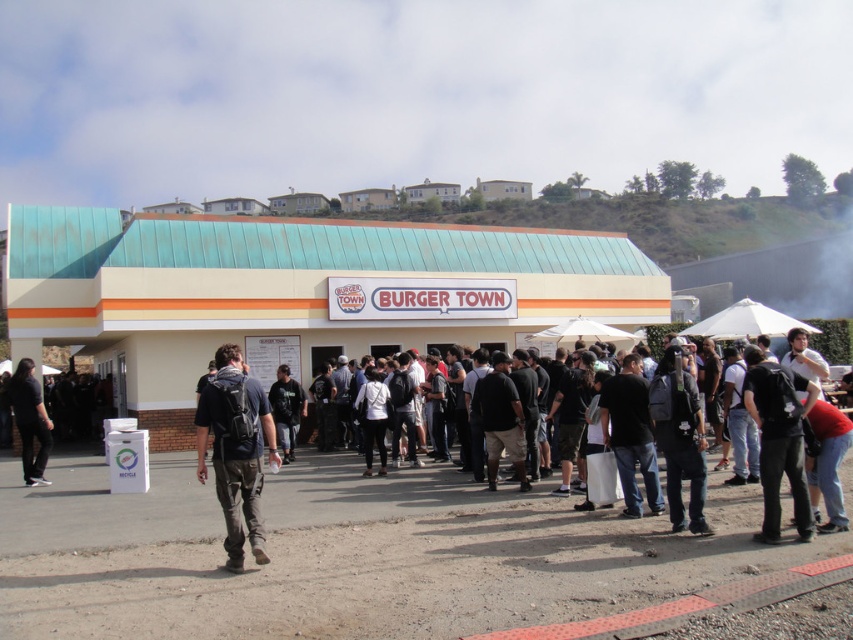
Question: Which object is the farthest from the black backpack at center?

Choices:
 (A) rubberized red line at lower center
 (B) white matte building at center
 (C) black matte shirt at center
 (D) dark gray fabric shirt at center

Answer: (B)

Question: Estimate the real-world distances between objects in this image. Which object is closer to the dark gray hoodie at center?

Choices:
 (A) black backpack at center
 (B) dark gray fabric shirt at center

Answer: (B)

Question: Among these points, which one is farthest from the camera?

Choices:
 (A) (248, 536)
 (B) (498, 368)

Answer: (B)

Question: Can you confirm if white matte building at center is thinner than dark blue jeans at center?

Choices:
 (A) yes
 (B) no

Answer: (B)

Question: Can you confirm if black matte shirt at center is thinner than dark gray hoodie at center?

Choices:
 (A) no
 (B) yes

Answer: (B)

Question: Is the position of dark blue t-shirt at center less distant than that of black backpack at center?

Choices:
 (A) no
 (B) yes

Answer: (B)